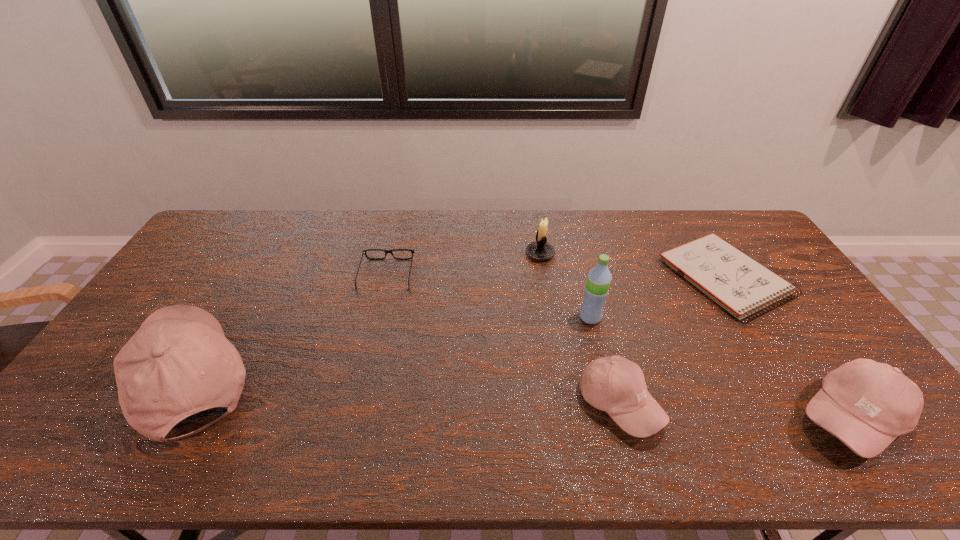
Locate an element on the screen. This screenshot has width=960, height=540. free space between the shortest object and the rightmost baseball cap is located at coordinates (787, 348).

This screenshot has height=540, width=960. I want to click on vacant space that's between the water bottle and the candle holder, so click(x=565, y=286).

Locate an element on the screen. The image size is (960, 540). blank region between the leftmost baseball cap and the water bottle is located at coordinates (391, 348).

Choose which object is the fourth nearest neighbor to the rightmost baseball cap. Please provide its 2D coordinates. Your answer should be formatted as a tuple, i.e. [(x, y)], where the tuple contains the x and y coordinates of a point satisfying the conditions above.

[(540, 250)]

Where is `object that stands as the closest to the rightmost baseball cap`? object that stands as the closest to the rightmost baseball cap is located at coordinates (741, 285).

Where is `baseball cap identified as the closest to the candle holder`? This screenshot has width=960, height=540. baseball cap identified as the closest to the candle holder is located at coordinates (614, 384).

At what (x,y) coordinates should I click in order to perform the action: click on the second closest baseball cap to the second object from left to right. Please return your answer as a coordinate pair (x, y). This screenshot has height=540, width=960. Looking at the image, I should click on (614, 384).